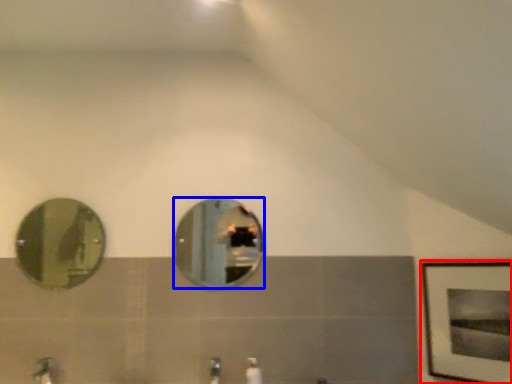
Question: Which object is further to the camera taking this photo, picture frame (highlighted by a red box) or mirror (highlighted by a blue box)?

Choices:
 (A) picture frame
 (B) mirror

Answer: (B)